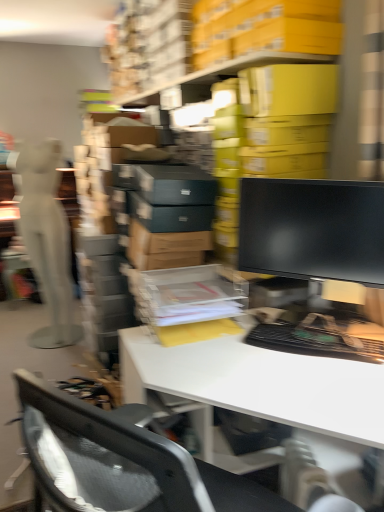
What do you see at coordinates (46, 238) in the screenshot?
I see `white matte mannequin at left` at bounding box center [46, 238].

In order to face white matte mannequin at left, should I rotate leftwards or rightwards?

You should rotate left by 18.999 degrees.

You are a GUI agent. You are given a task and a screenshot of the screen. Output one action in this format:
    pyautogui.click(x=<x>, y=<y>)
    Task: Click on the black glossy monitor at center
    The height and width of the screenshot is (512, 384).
    Given the screenshot: What is the action you would take?
    pyautogui.click(x=312, y=229)

Which is less distant, (378,270) or (334,429)?

Point (334,429)

How far apart are black glossy monitor at center and white glossy desk at center?

The distance of black glossy monitor at center from white glossy desk at center is 18.71 inches.

In the image, is black glossy monitor at center on the left side or the right side of white glossy desk at center?

black glossy monitor at center is to the right of white glossy desk at center.

Is black glossy monitor at center turned away from white glossy desk at center?

No, white glossy desk at center is not at the back of black glossy monitor at center.

From a real-world perspective, who is located higher, white matte mannequin at left or white glossy desk at center?

From a 3D spatial view, white matte mannequin at left is above.

The height and width of the screenshot is (512, 384). I want to click on desk on the right of white matte mannequin at left, so click(259, 383).

From the image's perspective, which is above, white matte mannequin at left or white glossy desk at center?

white matte mannequin at left is shown above in the image.

From a real-world perspective, is white matte mannequin at left on top of black glossy monitor at center?

Incorrect, from a real-world perspective, white matte mannequin at left is lower than black glossy monitor at center.

Is white matte mannequin at left far away from black glossy monitor at center?

white matte mannequin at left is positioned a significant distance from black glossy monitor at center.

Is black glossy monitor at center at the back of white matte mannequin at left?

No, black glossy monitor at center is not at the back of white matte mannequin at left.

Considering the positions of objects white matte mannequin at left and black glossy monitor at center in the image provided, who is more to the right, white matte mannequin at left or black glossy monitor at center?

black glossy monitor at center.

From a real-world perspective, is black glossy monitor at center physically above white matte mannequin at left?

Indeed, from a real-world perspective, black glossy monitor at center stands above white matte mannequin at left.

Looking at this image, is black glossy monitor at center thinner than white matte mannequin at left?

Yes.

Which is closer to the camera, (x=340, y=251) or (x=58, y=289)?

Point (x=340, y=251)

In terms of size, does black glossy monitor at center appear bigger or smaller than white matte mannequin at left?

Clearly, black glossy monitor at center is smaller in size than white matte mannequin at left.

Is white glossy desk at center facing towards white matte mannequin at left?

No, white glossy desk at center does not turn towards white matte mannequin at left.

Which is closer to the camera, (141, 388) or (20, 162)?

Point (141, 388) is positioned closer to the camera compared to point (20, 162).

Is white glossy desk at center surrounding white matte mannequin at left?

Definitely not — white matte mannequin at left is not inside white glossy desk at center.

Find the location of `desk on the right of white matte mannequin at left`. desk on the right of white matte mannequin at left is located at coordinates (259, 383).

From a real-world perspective, is white glossy desk at center physically located above or below black glossy monitor at center?

In terms of real-world spatial position, white glossy desk at center is below black glossy monitor at center.

Which is in front, white glossy desk at center or black glossy monitor at center?

white glossy desk at center is more forward.

Considering the sizes of objects white glossy desk at center and black glossy monitor at center in the image provided, who is thinner, white glossy desk at center or black glossy monitor at center?

black glossy monitor at center.

Can you confirm if white glossy desk at center is taller than black glossy monitor at center?

Indeed, white glossy desk at center has a greater height compared to black glossy monitor at center.

Find the location of `computer monitor above the white glossy desk at center (from a real-world perspective)`. computer monitor above the white glossy desk at center (from a real-world perspective) is located at coordinates (312, 229).

Find the location of a particular element. This screenshot has height=512, width=384. desk below the white matte mannequin at left (from the image's perspective) is located at coordinates (259, 383).

Which object lies nearer to the anchor point white matte mannequin at left, black glossy monitor at center or white glossy desk at center?

Based on the image, white glossy desk at center appears to be nearer to white matte mannequin at left.

Which object lies nearer to the anchor point black glossy monitor at center, white matte mannequin at left or white glossy desk at center?

Based on the image, white glossy desk at center appears to be nearer to black glossy monitor at center.

Which object lies nearer to the anchor point black glossy monitor at center, white glossy desk at center or white matte mannequin at left?

white glossy desk at center is closer to black glossy monitor at center.

From the image, which object appears to be nearer to white matte mannequin at left, white glossy desk at center or black glossy monitor at center?

white glossy desk at center lies closer to white matte mannequin at left than the other object.

Based on their spatial positions, is white matte mannequin at left or black glossy monitor at center closer to white glossy desk at center?

Based on the image, black glossy monitor at center appears to be nearer to white glossy desk at center.

Estimate the real-world distances between objects in this image. Which object is further from white glossy desk at center, black glossy monitor at center or white matte mannequin at left?

white matte mannequin at left is further to white glossy desk at center.

Find the location of `computer monitor between white glossy desk at center and white matte mannequin at left along the z-axis`. computer monitor between white glossy desk at center and white matte mannequin at left along the z-axis is located at coordinates (312, 229).